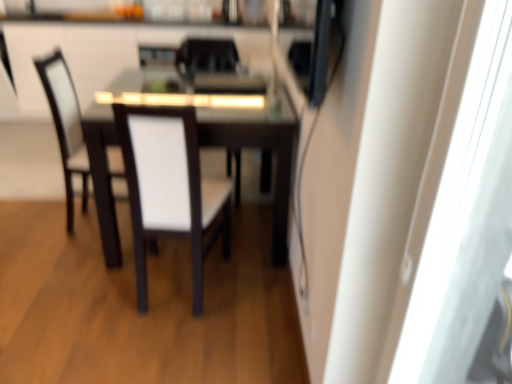
The image size is (512, 384). Find the location of `free region under white fabric chair at center, the fourth chair from the back (from a real-world perspective)`. free region under white fabric chair at center, the fourth chair from the back (from a real-world perspective) is located at coordinates (174, 284).